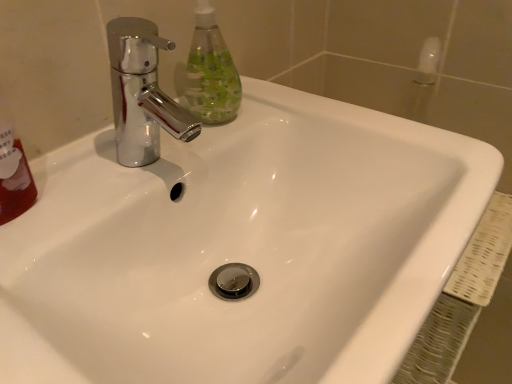
Question: Choose the correct answer: Is chrome metallic faucet at upper left inside clear plastic bottle at upper left or outside it?

Choices:
 (A) outside
 (B) inside

Answer: (A)

Question: From a real-world perspective, relative to clear plastic bottle at upper left, is chrome metallic faucet at upper left vertically above or below?

Choices:
 (A) above
 (B) below

Answer: (B)

Question: In terms of height, does chrome metallic faucet at upper left look taller or shorter compared to clear plastic bottle at upper left?

Choices:
 (A) short
 (B) tall

Answer: (A)

Question: Is clear plastic bottle at upper left in front of or behind chrome metallic faucet at upper left in the image?

Choices:
 (A) behind
 (B) front

Answer: (A)

Question: In terms of width, does clear plastic bottle at upper left look wider or thinner when compared to chrome metallic faucet at upper left?

Choices:
 (A) wide
 (B) thin

Answer: (B)

Question: Is point (226, 71) closer or farther from the camera than point (148, 86)?

Choices:
 (A) closer
 (B) farther

Answer: (A)

Question: Would you say clear plastic bottle at upper left is inside or outside chrome metallic faucet at upper left?

Choices:
 (A) inside
 (B) outside

Answer: (B)